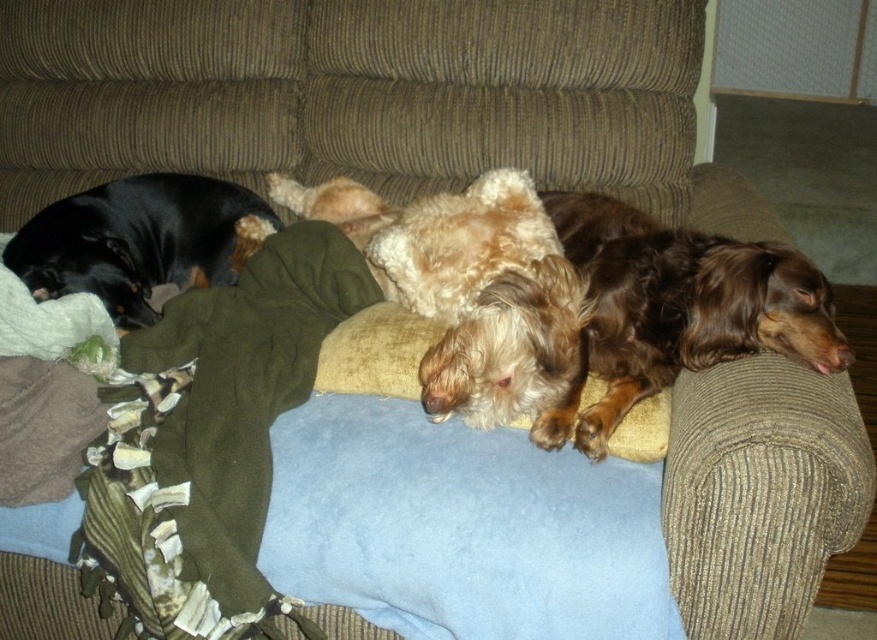
Question: Among these points, which one is farthest from the camera?

Choices:
 (A) (783, 269)
 (B) (36, 248)

Answer: (B)

Question: Does brown silky dog at right come in front of black smooth coat at left?

Choices:
 (A) no
 (B) yes

Answer: (B)

Question: Estimate the real-world distances between objects in this image. Which object is farther from the brown silky dog at right?

Choices:
 (A) green fleece blanket at lower left
 (B) black smooth coat at left

Answer: (B)

Question: Is brown silky dog at right positioned in front of black smooth coat at left?

Choices:
 (A) no
 (B) yes

Answer: (B)

Question: Where is brown silky dog at right located in relation to black smooth coat at left in the image?

Choices:
 (A) right
 (B) left

Answer: (A)

Question: Which of these objects is positioned farthest from the green fleece blanket at lower left?

Choices:
 (A) brown silky dog at right
 (B) black smooth coat at left

Answer: (A)